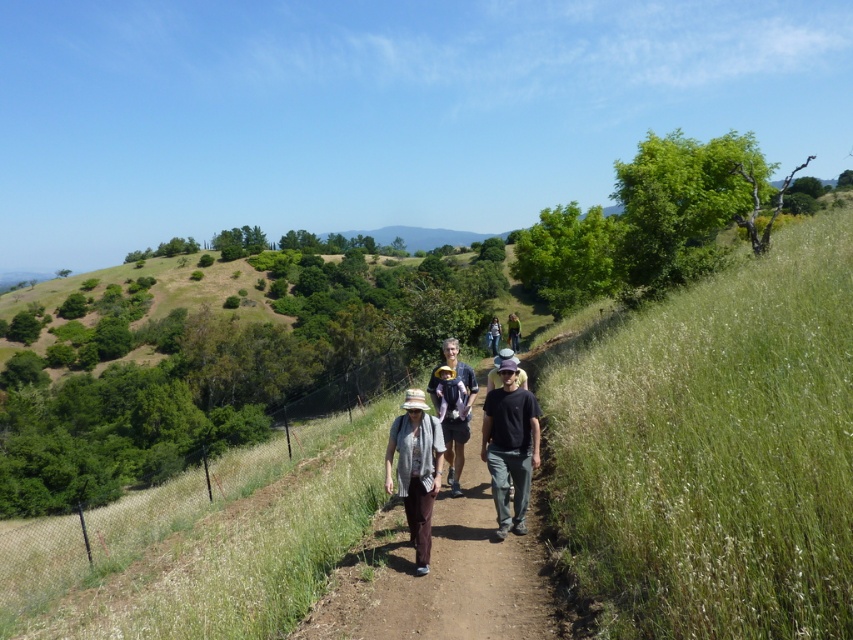
You are a hiker trying to catch up with the group. You see the black cotton shirt at center and the light brown leather jacket at center. Which person should you follow to stay with the group?

You should follow the black cotton shirt at center because it is closer to you than the light brown leather jacket at center, indicating they are ahead in the group.

You are a hiker who wants to reach the point at coordinates (519, 401). Given that your average walking speed is 3 km per hour, how many minutes will it take you to reach that point?

The distance between the point at coordinates (519, 401) and the camera is 6.83 meters. At an average walking speed of 3 km per hour, it would take approximately 0.14 minutes to reach the point.